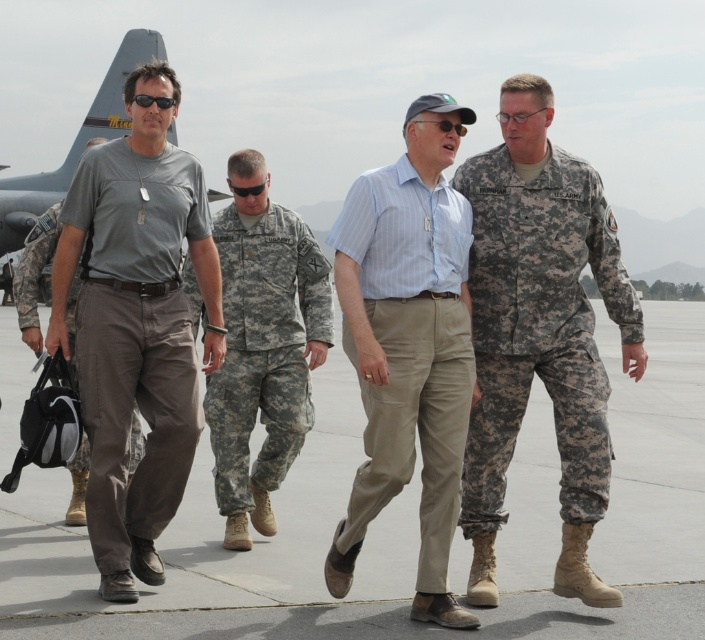
You are a photographer standing on the edge of the tarmac. You want to take a photo that includes both the light gray concrete at center and the light blue striped shirt at center. Which object should you zoom in on to ensure both are visible in the frame?

The light gray concrete at center is wider than the light blue striped shirt at center, so you should zoom in on the light gray concrete at center to ensure both are visible in the frame.

You are a photographer standing on the airfield tarmac. You want to take a photo of the light gray concrete at center and the light blue striped shirt at center. Which object should you adjust your camera to focus on first if you want to capture both in the same frame?

The light gray concrete at center is to the left of light blue striped shirt at center, so you should focus on the light gray concrete at center first as it is closer to the left side of the frame.